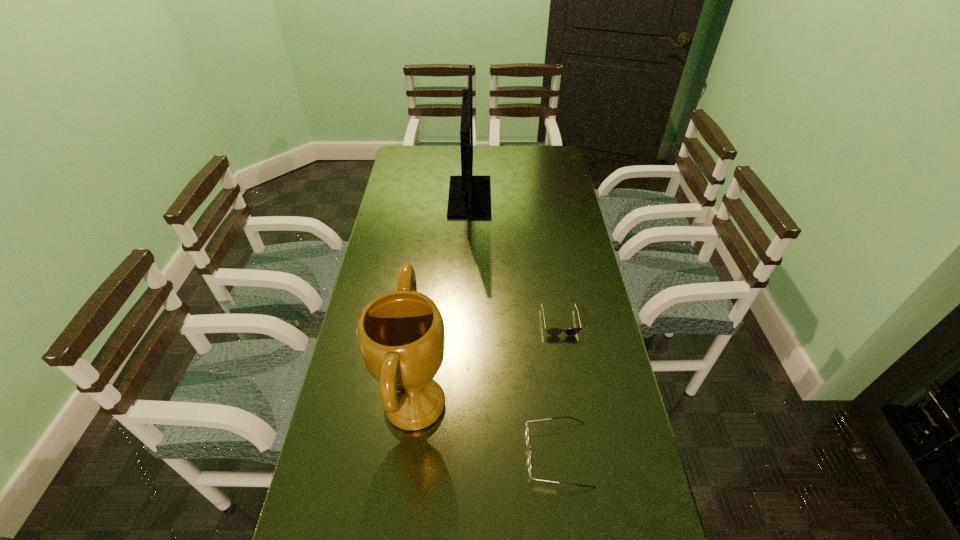
Identify the location of vacant space located 0.390m through the lenses of the spectacles. (367, 454).

The width and height of the screenshot is (960, 540). In order to click on vacant space located on the front lenses of the second farthest object in this screenshot , I will do (585, 471).

You are a GUI agent. You are given a task and a screenshot of the screen. Output one action in this format:
    pyautogui.click(x=<x>, y=<y>)
    Task: Click on the object present at the far edge
    Image resolution: width=960 pixels, height=540 pixels.
    Given the screenshot: What is the action you would take?
    pyautogui.click(x=469, y=197)

Find the location of a particular element. object that is at the left edge is located at coordinates (401, 335).

Where is `spectacles that is positioned at the right edge`? spectacles that is positioned at the right edge is located at coordinates (527, 433).

At what (x,y) coordinates should I click in order to perform the action: click on sunglasses positioned at the right edge. Please return your answer as a coordinate pair (x, y). Looking at the image, I should click on (551, 331).

Image resolution: width=960 pixels, height=540 pixels. I want to click on vacant area at the far edge of the desktop, so click(439, 171).

Locate an element on the screen. free region at the left edge of the desktop is located at coordinates (346, 496).

The image size is (960, 540). In the image, there is a desktop. What are the coordinates of `free region at the right edge` in the screenshot? It's located at (589, 274).

The image size is (960, 540). In the image, there is a desktop. Identify the location of vacant space at the far left corner. (419, 152).